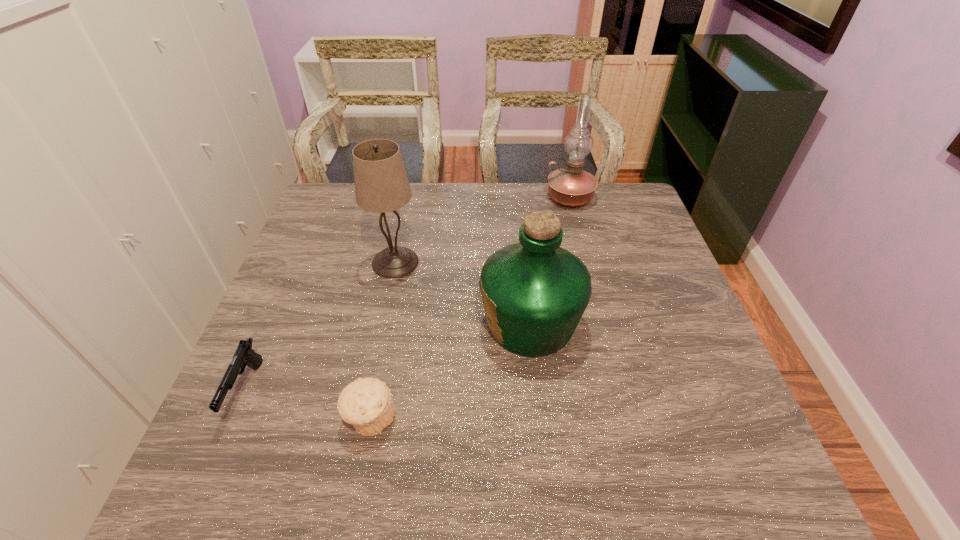
Image resolution: width=960 pixels, height=540 pixels. Find the location of `vacant area in the image that satisfies the following two spatial constraints: 1. on the front-facing side of the muffin; 2. on the right side of the lampshade`. vacant area in the image that satisfies the following two spatial constraints: 1. on the front-facing side of the muffin; 2. on the right side of the lampshade is located at coordinates click(364, 418).

Find the location of a particular element. The height and width of the screenshot is (540, 960). vacant space that satisfies the following two spatial constraints: 1. on the label side of the liquor; 2. at the aiming end of the leftmost object is located at coordinates (538, 390).